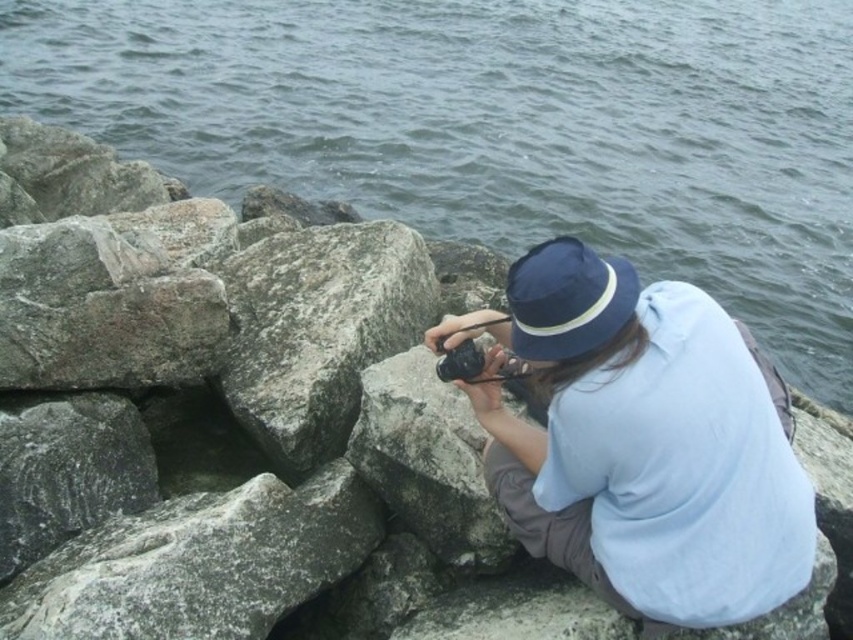
You are a photographer aiming to capture the gray rough rock at center without the gray water at upper center overlapping it. Based on their positions, is this possible?

Yes, since the gray water at upper center is further away from the viewer than the gray rough rock at center, you can adjust your camera angle to focus on the gray rough rock at center and avoid overlapping with the gray water at upper center.

You are a photographer trying to capture the scene from the same position as the person in the image. If you want to include both the blue fabric hat at center and the gray rough stone at lower left in your photo, which object should you focus on first to ensure both are in frame?

The blue fabric hat at center has a larger size compared to the gray rough stone at lower left, so you should focus on the blue fabric hat at center first to ensure both are in frame.

Consider the image. You are a photographer trying to capture the blue fabric hat at center and the gray rough rock at center in your shot. Which object should you focus on first if you want to ensure both are in frame without moving the camera?

The blue fabric hat at center occupies less space than the gray rough rock at center, so you should focus on the gray rough rock at center first to ensure it fits properly in the frame.